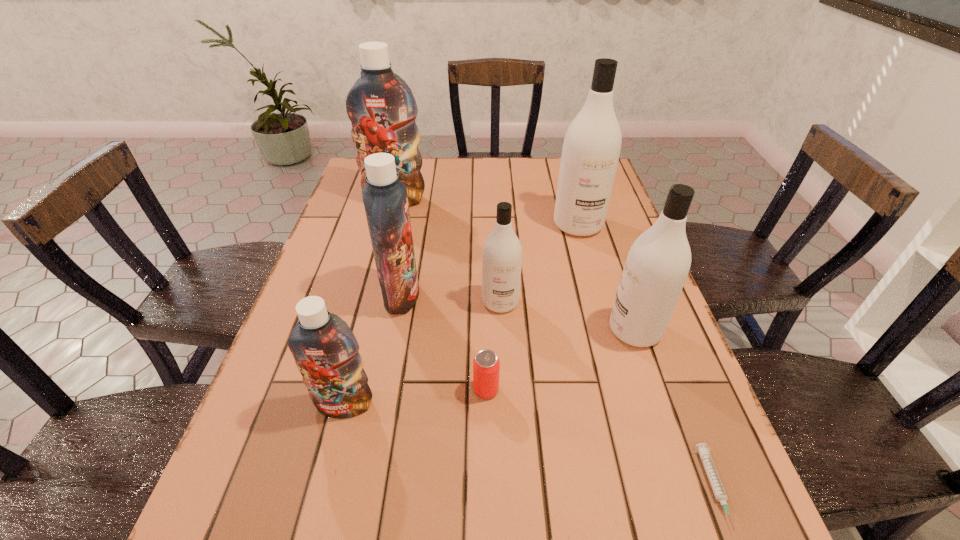
In the image, there is a desktop. Where is `vacant area at the right edge`? This screenshot has width=960, height=540. vacant area at the right edge is located at coordinates (632, 243).

This screenshot has width=960, height=540. Find the location of `free point at the near right corner`. free point at the near right corner is located at coordinates (711, 536).

Image resolution: width=960 pixels, height=540 pixels. In order to click on vacant space that's between the nearest blue shampoo and the biggest blue shampoo in this screenshot , I will do `click(370, 302)`.

Identify the location of empty space that is in between the beer can and the biggest white shampoo. This screenshot has height=540, width=960. (532, 307).

This screenshot has width=960, height=540. In order to click on free space that is in between the leftmost white shampoo and the red beer can in this screenshot , I will do `click(493, 346)`.

Where is `free space between the smallest blue shampoo and the second farthest blue shampoo`? This screenshot has width=960, height=540. free space between the smallest blue shampoo and the second farthest blue shampoo is located at coordinates (372, 350).

Locate an element on the screen. The image size is (960, 540). vacant area that lies between the shortest object and the second smallest white shampoo is located at coordinates 675,409.

The image size is (960, 540). I want to click on free spot between the shortest object and the second shortest object, so click(600, 439).

Where is `free space between the smallest blue shampoo and the syringe`? This screenshot has height=540, width=960. free space between the smallest blue shampoo and the syringe is located at coordinates (530, 447).

The image size is (960, 540). What are the coordinates of `vacant area that lies between the biggest blue shampoo and the nearest blue shampoo` in the screenshot? It's located at (370, 302).